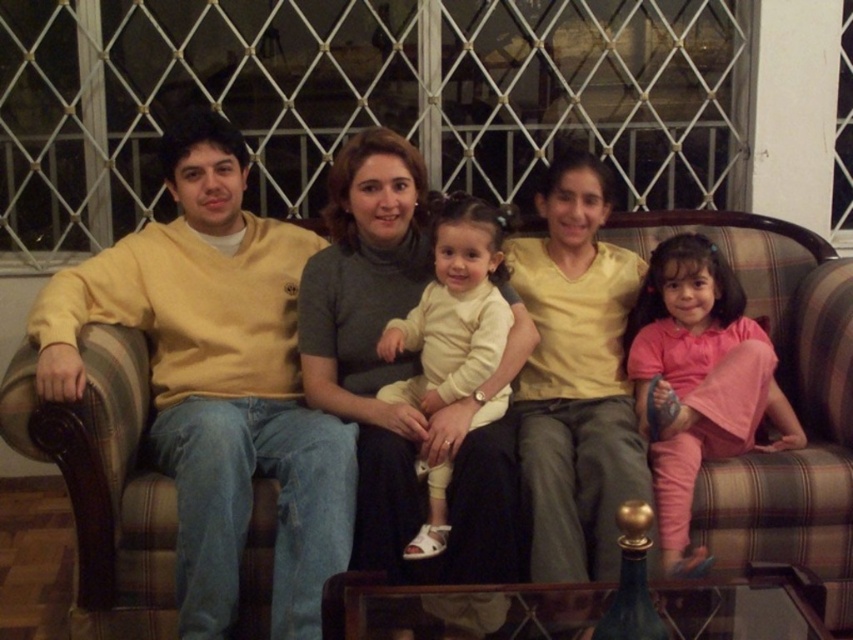
You are standing in front of the family sofa scene. There are two points marked in the image. The first point is at coordinates point [550,296] and the second point is at point [675,556]. Which of these two points is closer to you?

Point [550,296] is closer to you because it is further to the viewer than point [675,556].

You are a furniture designer evaluating the living room setup. You need to determine if the matte gray sweater at center can be placed on the plaid fabric couch at center without covering the entire surface. Based on their sizes, what do you think?

The plaid fabric couch at center is taller than the matte gray sweater at center, so the sweater can be placed on the couch without covering the entire surface since the couch is larger in height.